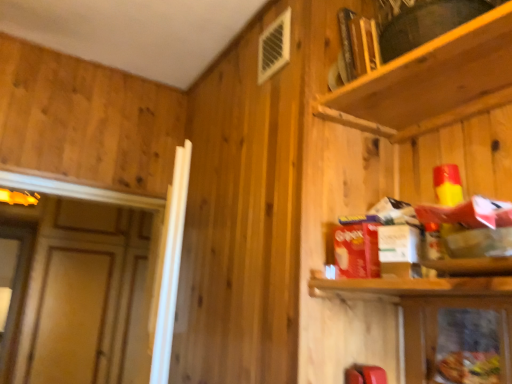
Question: In terms of height, does metallic silver cabinet at lower right look taller or shorter compared to wooden shelf at upper right?

Choices:
 (A) tall
 (B) short

Answer: (B)

Question: From a real-world perspective, is metallic silver cabinet at lower right physically located above or below wooden shelf at upper right?

Choices:
 (A) above
 (B) below

Answer: (B)

Question: From the image's perspective, is metallic silver cabinet at lower right located above or below wooden shelf at upper right?

Choices:
 (A) above
 (B) below

Answer: (B)

Question: From a real-world perspective, is wooden shelf at upper right above or below metallic silver cabinet at lower right?

Choices:
 (A) above
 (B) below

Answer: (A)

Question: From their relative heights in the image, would you say wooden shelf at upper right is taller or shorter than metallic silver cabinet at lower right?

Choices:
 (A) short
 (B) tall

Answer: (B)

Question: From the image's perspective, is wooden shelf at upper right above or below metallic silver cabinet at lower right?

Choices:
 (A) below
 (B) above

Answer: (B)

Question: Is point (420, 99) positioned closer to the camera than point (499, 354)?

Choices:
 (A) farther
 (B) closer

Answer: (A)